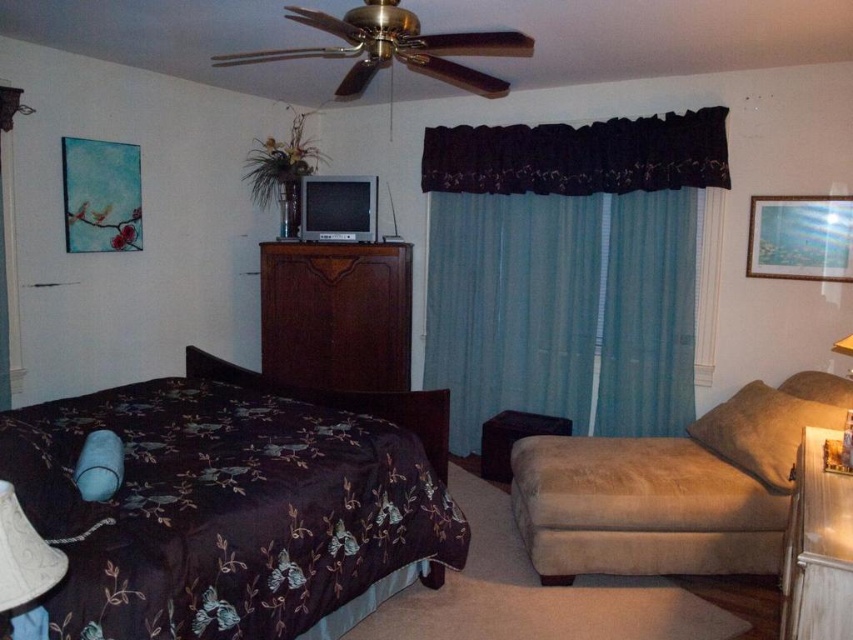
Between point (361, 548) and point (563, 470), which one is positioned behind?

The point (563, 470) is more distant.

The height and width of the screenshot is (640, 853). I want to click on dark floral fabric bed at center, so click(233, 502).

Based on the photo, between dark floral fabric bed at center and dark wood dresser at center, which one is positioned lower?

dark floral fabric bed at center is below.

Who is positioned more to the right, dark floral fabric bed at center or dark wood dresser at center?

dark wood dresser at center is more to the right.

You are a GUI agent. You are given a task and a screenshot of the screen. Output one action in this format:
    pyautogui.click(x=<x>, y=<y>)
    Task: Click on the dark floral fabric bed at center
    
    Given the screenshot: What is the action you would take?
    pyautogui.click(x=233, y=502)

Is teal fabric curtain at center shorter than dark wood dresser at center?

Incorrect, teal fabric curtain at center's height does not fall short of dark wood dresser at center's.

Is teal fabric curtain at center below dark wood dresser at center?

Incorrect, teal fabric curtain at center is not positioned below dark wood dresser at center.

I want to click on teal fabric curtain at center, so click(x=567, y=269).